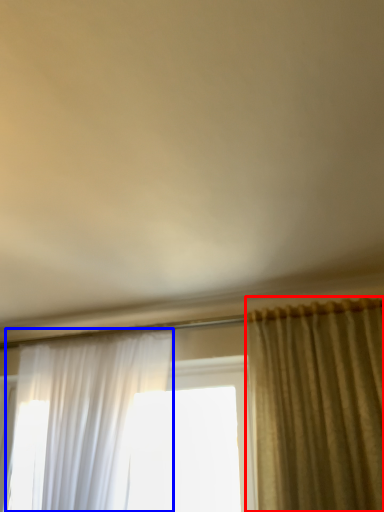
Question: Which point is further to the camera, curtain (highlighted by a red box) or curtain (highlighted by a blue box)?

Choices:
 (A) curtain
 (B) curtain

Answer: (B)